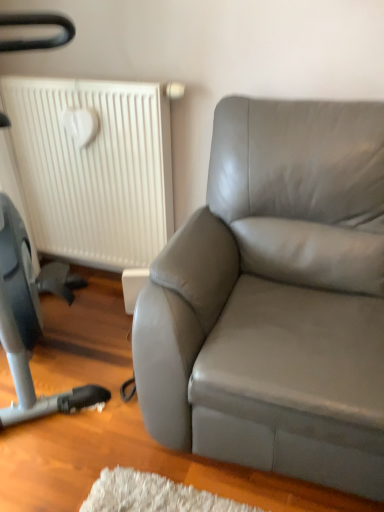
Measure the distance between white matte radiator at upper left and camera.

1.74 meters.

Where is `white matte radiator at upper left`? white matte radiator at upper left is located at coordinates (90, 168).

Describe the element at coordinates (90, 168) in the screenshot. I see `white matte radiator at upper left` at that location.

What do you see at coordinates (276, 298) in the screenshot?
I see `satin gray leather couch at right` at bounding box center [276, 298].

Identify the location of satin gray leather couch at right. The height and width of the screenshot is (512, 384). (276, 298).

This screenshot has height=512, width=384. Find the location of `white matte radiator at upper left`. white matte radiator at upper left is located at coordinates [x=90, y=168].

In the image, is white matte radiator at upper left on the left side or the right side of satin gray leather couch at right?

Clearly, white matte radiator at upper left is on the left of satin gray leather couch at right in the image.

Considering the relative positions of white matte radiator at upper left and satin gray leather couch at right in the image provided, is white matte radiator at upper left behind satin gray leather couch at right?

Yes, white matte radiator at upper left is further from the camera.

Considering the positions of points (4, 172) and (182, 323), is point (4, 172) farther from camera compared to point (182, 323)?

Yes, it is.

Consider the image. From the image's perspective, who appears lower, white matte radiator at upper left or satin gray leather couch at right?

satin gray leather couch at right, from the image's perspective.

Based on the photo, from a real-world perspective, which is physically below, white matte radiator at upper left or satin gray leather couch at right?

In real-world perspective, satin gray leather couch at right is lower.

Considering the relative sizes of white matte radiator at upper left and satin gray leather couch at right in the image provided, is white matte radiator at upper left thinner than satin gray leather couch at right?

Yes.

Between white matte radiator at upper left and satin gray leather couch at right, which one has less height?

white matte radiator at upper left.

Looking at this image, is white matte radiator at upper left bigger than satin gray leather couch at right?

Incorrect, white matte radiator at upper left is not larger than satin gray leather couch at right.

Is white matte radiator at upper left inside the boundaries of satin gray leather couch at right, or outside?

white matte radiator at upper left is outside satin gray leather couch at right.

Is white matte radiator at upper left next to satin gray leather couch at right?

No, white matte radiator at upper left is not with satin gray leather couch at right.

Is satin gray leather couch at right at the back of white matte radiator at upper left?

No.

Can you tell me how much white matte radiator at upper left and satin gray leather couch at right differ in facing direction?

0.000829 degrees.

Find the location of `studio couch lying in front of the white matte radiator at upper left`. studio couch lying in front of the white matte radiator at upper left is located at coordinates (276, 298).

Based on the photo, between satin gray leather couch at right and white matte radiator at upper left, which one appears on the left side from the viewer's perspective?

From the viewer's perspective, white matte radiator at upper left appears more on the left side.

Who is more distant, satin gray leather couch at right or white matte radiator at upper left?

white matte radiator at upper left is more distant.

Which is farther from the camera, [239,285] or [143,258]?

Positioned behind is point [143,258].

From the image's perspective, who appears lower, satin gray leather couch at right or white matte radiator at upper left?

satin gray leather couch at right is shown below in the image.

From a real-world perspective, is satin gray leather couch at right under white matte radiator at upper left?

Yes, from a real-world perspective, satin gray leather couch at right is under white matte radiator at upper left.

Based on the photo, in terms of width, does satin gray leather couch at right look wider or thinner when compared to white matte radiator at upper left?

In the image, satin gray leather couch at right appears to be wider than white matte radiator at upper left.

Considering the sizes of objects satin gray leather couch at right and white matte radiator at upper left in the image provided, who is shorter, satin gray leather couch at right or white matte radiator at upper left?

With less height is white matte radiator at upper left.

Considering the sizes of objects satin gray leather couch at right and white matte radiator at upper left in the image provided, who is bigger, satin gray leather couch at right or white matte radiator at upper left?

Bigger between the two is satin gray leather couch at right.

Does satin gray leather couch at right contain white matte radiator at upper left?

No, white matte radiator at upper left is not surrounded by satin gray leather couch at right.

Is satin gray leather couch at right directly adjacent to white matte radiator at upper left?

No.

Is white matte radiator at upper left at the back of satin gray leather couch at right?

No, satin gray leather couch at right is not facing away from white matte radiator at upper left.

You are a GUI agent. You are given a task and a screenshot of the screen. Output one action in this format:
    pyautogui.click(x=<x>, y=<y>)
    Task: Click on the radiator above the satin gray leather couch at right (from a real-world perspective)
    The height and width of the screenshot is (512, 384).
    Given the screenshot: What is the action you would take?
    pyautogui.click(x=90, y=168)

Where is `studio couch in front of the white matte radiator at upper left`? This screenshot has width=384, height=512. studio couch in front of the white matte radiator at upper left is located at coordinates (276, 298).

Where is `studio couch located below the white matte radiator at upper left (from the image's perspective)`? This screenshot has height=512, width=384. studio couch located below the white matte radiator at upper left (from the image's perspective) is located at coordinates (276, 298).